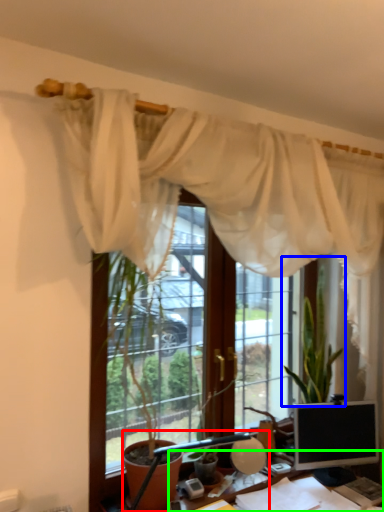
Question: Estimate the real-world distances between objects in this image. Which object is closer to table lamp (highlighted by a red box), houseplant (highlighted by a blue box) or desk (highlighted by a green box)?

Choices:
 (A) houseplant
 (B) desk

Answer: (B)